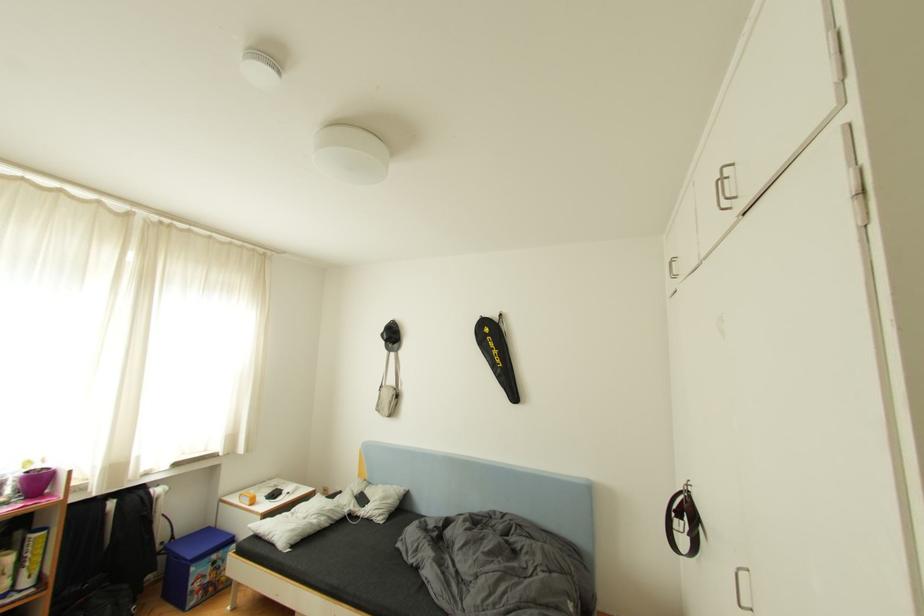
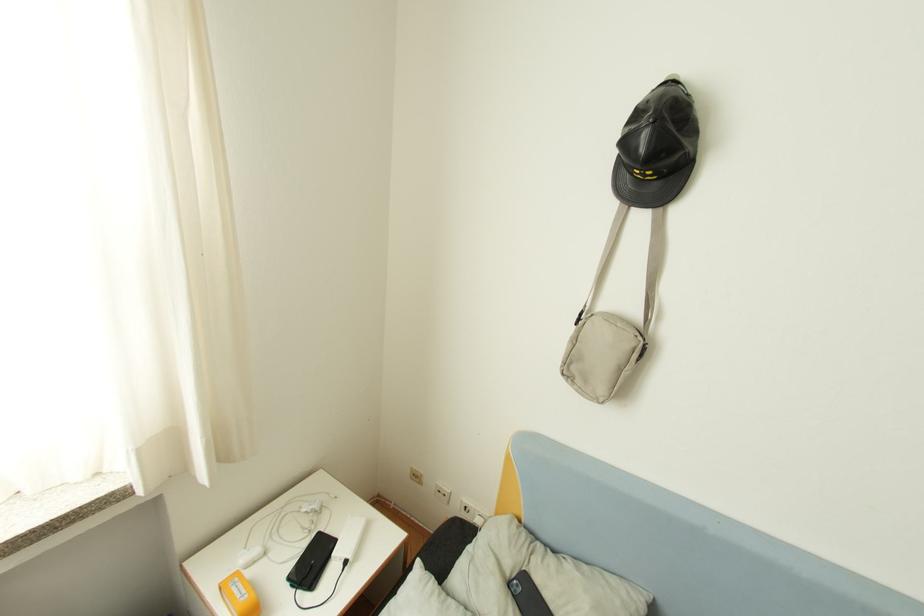
What movement of the cameraman would produce the second image?

The movement direction of the cameraman is left, forward.